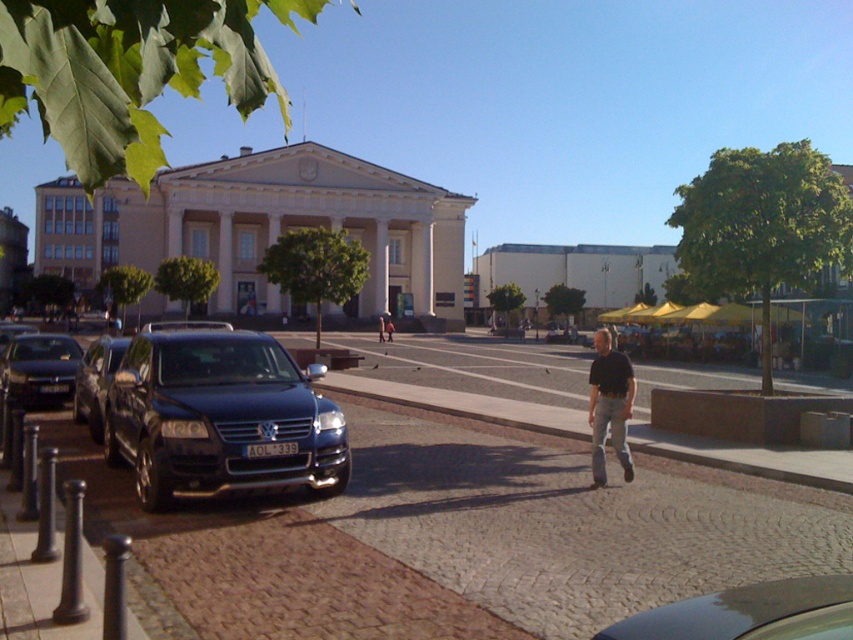
You are a delivery driver who needs to park your vehicle in this area. The parking zone is marked from coordinates 0.6 to 0.7 on the x and y axes. Is the shiny dark blue suv at left within the parking zone?

The shiny dark blue suv at left is at point (219,416). Since the parking zone spans from 0.6 to 0.7 on both axes, the suv is within the designated area.

You are standing at the cobblestone street in the urban scene. There are two points marked in the image. The first point is at coordinates point (769, 600) and the second point is at coordinates point (82, 355). Which of these two points is closer to you?

Point (769, 600) is closer to the viewer than point (82, 355).